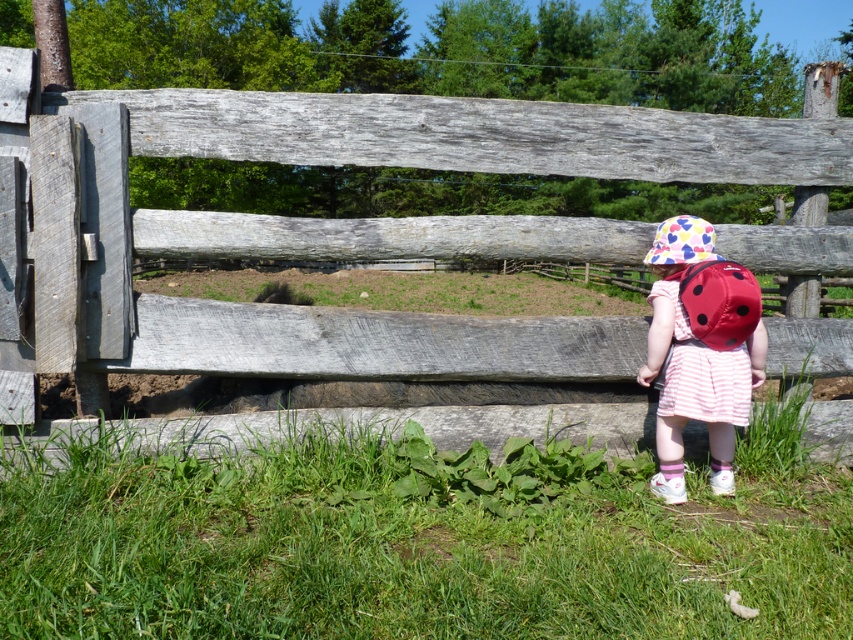
You are a drone operator trying to capture aerial footage of the child and the fence. Your drone has a camera that can only focus on objects within a 0.3 unit radius. If you position the drone at point A, which is point (648, 260), will the fence at point B, which is point (675, 220), be within the camera focus range?

Point A is behind point B. Since point B is closer to the drone at point A, the distance between them is less than 0.3 units, so the fence at point B will be within the camera focus range.

You are a drone operator trying to capture a photo of the child in the scene. You have two points marked on your screen. The first point is at coordinate point (111, 563) and the second is at point (693, 240). Which point should you use to position the drone so that it is closer to the child?

Point (111, 563) is in front of point (693, 240), so positioning the drone at point (111, 563) would place it closer to the child.

You are a tailor who needs to determine which hat requires more fabric to make between the polka dot fabric hat at center and the multicolored fabric hat at center. Which one would you choose?

The polka dot fabric hat at center requires more fabric because it is bigger than the multicolored fabric hat at center.